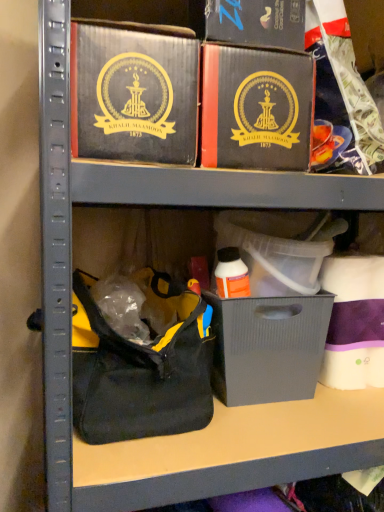
Question: From the image's perspective, is matte black box at upper center, the second box in the right-to-left sequence, beneath matte black box at upper center?

Choices:
 (A) no
 (B) yes

Answer: (B)

Question: Is matte black box at upper center, the second box in the right-to-left sequence, completely or partially outside of matte black box at upper center?

Choices:
 (A) yes
 (B) no

Answer: (A)

Question: Is matte black box at upper center, the second box in the right-to-left sequence, thinner than matte black box at upper center?

Choices:
 (A) no
 (B) yes

Answer: (A)

Question: Is matte black box at upper center completely or partially inside matte black box at upper center, the second box in the right-to-left sequence?

Choices:
 (A) yes
 (B) no

Answer: (B)

Question: From the image's perspective, is matte black box at upper center, which is counted as the 1th box, starting from the left, located above matte black box at upper center?

Choices:
 (A) yes
 (B) no

Answer: (B)

Question: From a real-world perspective, is matte black box at upper center, the second box in the right-to-left sequence, on matte black box at upper center?

Choices:
 (A) no
 (B) yes

Answer: (A)

Question: Considering the relative positions of matte black box at upper center, which is counted as the 1th box, starting from the left, and black fabric handbag at lower left in the image provided, is matte black box at upper center, which is counted as the 1th box, starting from the left, behind black fabric handbag at lower left?

Choices:
 (A) yes
 (B) no

Answer: (B)

Question: Can you confirm if matte black box at upper center, the second box in the right-to-left sequence, is wider than black fabric handbag at lower left?

Choices:
 (A) no
 (B) yes

Answer: (B)

Question: From the image's perspective, is matte black box at upper center, which is counted as the 1th box, starting from the left, below black fabric handbag at lower left?

Choices:
 (A) yes
 (B) no

Answer: (B)

Question: Is matte black box at upper center, the second box in the right-to-left sequence, far away from black fabric handbag at lower left?

Choices:
 (A) yes
 (B) no

Answer: (B)

Question: Is matte black box at upper center, the second box in the right-to-left sequence, positioned before black fabric handbag at lower left?

Choices:
 (A) yes
 (B) no

Answer: (A)

Question: Does matte black box at upper center, which is counted as the 1th box, starting from the left, have a lesser width compared to black fabric handbag at lower left?

Choices:
 (A) yes
 (B) no

Answer: (B)

Question: Considering the relative sizes of matte black box at upper center and matte gray plastic bin at center in the image provided, is matte black box at upper center smaller than matte gray plastic bin at center?

Choices:
 (A) yes
 (B) no

Answer: (B)